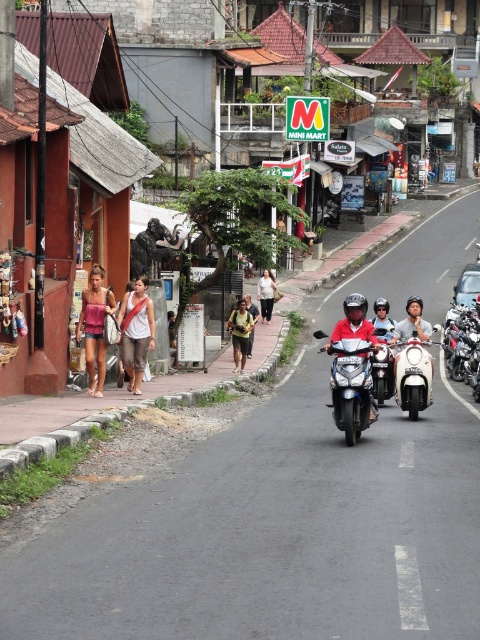
Question: Is matte pink tank top at center wider than shiny chrome motorcycle at center?

Choices:
 (A) yes
 (B) no

Answer: (A)

Question: Estimate the real-world distances between objects in this image. Which object is closer to the shiny chrome motorcycle at center?

Choices:
 (A) white cotton tank top at center
 (B) white glossy scooter at center
 (C) white cotton shirt at center
 (D) matte pink tank top at center

Answer: (B)

Question: Does white cotton tank top at center appear under shiny chrome motorcycle at center?

Choices:
 (A) no
 (B) yes

Answer: (A)

Question: Which of these objects is positioned closest to the shiny chrome motorcycle at center?

Choices:
 (A) white glossy scooter at center
 (B) shiny silver motorcycle at center
 (C) yellow fabric bag at center

Answer: (A)

Question: Does white glossy scooter at center have a lesser width compared to shiny chrome motorcycle at center?

Choices:
 (A) no
 (B) yes

Answer: (A)

Question: Among these objects, which one is farthest from the camera?

Choices:
 (A) matte pink tank top at center
 (B) white cotton tank top at center
 (C) white glossy scooter at center

Answer: (B)